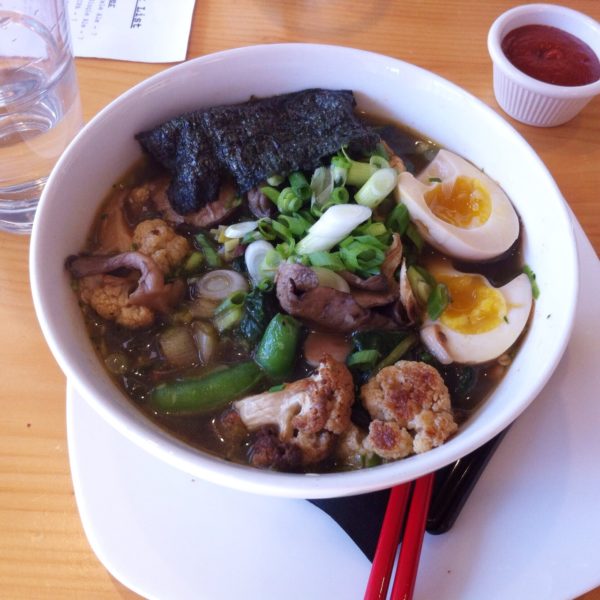
Where is `dish`? Image resolution: width=600 pixels, height=600 pixels. dish is located at coordinates (513, 407).